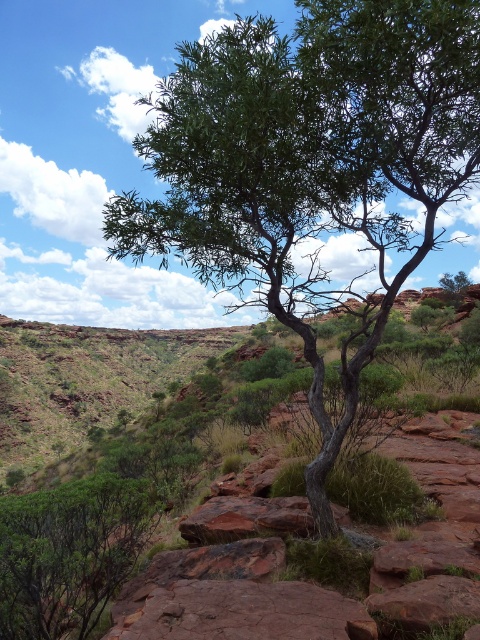
Which is more to the left, green leafy bush at lower left or reddish-brown rock at center?

green leafy bush at lower left

Can you confirm if green leafy bush at lower left is positioned to the left of reddish-brown rock at center?

Correct, you'll find green leafy bush at lower left to the left of reddish-brown rock at center.

This screenshot has width=480, height=640. In order to click on green leafy bush at lower left in this screenshot , I will do `click(70, 554)`.

Is green leafy tree at center to the right of green leafy bush at lower left from the viewer's perspective?

Yes, green leafy tree at center is to the right of green leafy bush at lower left.

How distant is green leafy tree at center from green leafy bush at lower left?

The distance of green leafy tree at center from green leafy bush at lower left is 8.77 meters.

Identify the location of green leafy tree at center. This screenshot has height=640, width=480. (310, 163).

Does green leafy tree at center have a larger size compared to reddish-brown rock at center?

Correct, green leafy tree at center is larger in size than reddish-brown rock at center.

Does green leafy tree at center have a greater height compared to reddish-brown rock at center?

Yes, green leafy tree at center is taller than reddish-brown rock at center.

Is point (242, 228) closer to viewer compared to point (330, 596)?

No, (242, 228) is behind (330, 596).

Locate an element on the screen. This screenshot has width=480, height=640. green leafy tree at center is located at coordinates (310, 163).